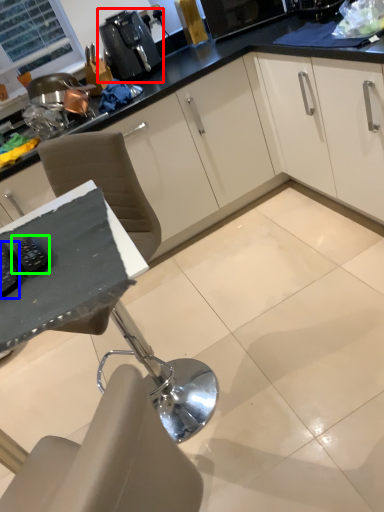
Question: Based on their relative distances, which object is farther from coffee machine (highlighted by a red box)? Choose from appliance (highlighted by a blue box) and appliance (highlighted by a green box).

Choices:
 (A) appliance
 (B) appliance

Answer: (A)